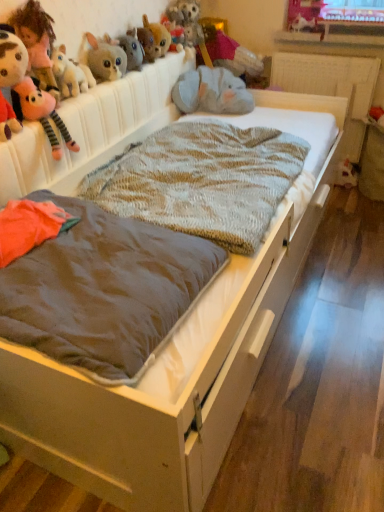
Question: From their relative heights in the image, would you say fluffy gray stuffed animal at upper center, the fourth toy when ordered from right to left, is taller or shorter than fluffy pink plush at upper left, arranged as the 9th toy when viewed from the right?

Choices:
 (A) short
 (B) tall

Answer: (A)

Question: Is point (183, 27) closer or farther from the camera than point (13, 27)?

Choices:
 (A) farther
 (B) closer

Answer: (A)

Question: Estimate the real-world distances between objects in this image. Which object is closer to the white plush toy at lower right, arranged as the tenth toy when viewed from the left?

Choices:
 (A) fluffy pink plush at upper left, the first toy viewed from the left
 (B) fuzzy brown plush at upper center, marked as the sixth toy in a right-to-left arrangement
 (C) fuzzy plush toy at upper center, which is the 6th toy in left-to-right order
 (D) fluffy gray stuffed animal at upper center, the fourth toy when ordered from right to left
 (E) fluffy gray plush at upper left, arranged as the 7th toy when viewed from the right

Answer: (D)

Question: Which object is the farthest from the white plush toy at lower right, which appears as the 1th toy when viewed from the right?

Choices:
 (A) velvet pink teddy bear at upper center, placed as the second toy when sorted from right to left
 (B) fluffy gray stuffed animal at upper center, the fourth toy when ordered from right to left
 (C) brown fabric mattress at center
 (D) fuzzy gray elephant at upper center, acting as the 8th toy starting from the left
 (E) fuzzy plush toy at upper center, which is the 6th toy in left-to-right order

Answer: (C)